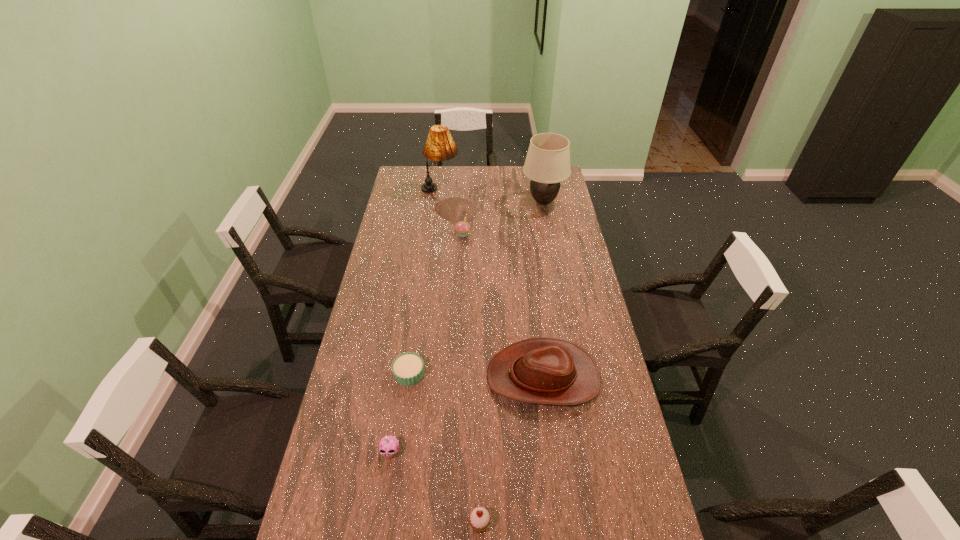
Where is `the left lampshade`? Image resolution: width=960 pixels, height=540 pixels. the left lampshade is located at coordinates (440, 146).

You are a GUI agent. You are given a task and a screenshot of the screen. Output one action in this format:
    pyautogui.click(x=<x>, y=<y>)
    Task: Click on the right lampshade
    The width and height of the screenshot is (960, 540).
    Given the screenshot: What is the action you would take?
    pyautogui.click(x=547, y=163)

The height and width of the screenshot is (540, 960). What are the coordinates of `the farthest cupcake` in the screenshot? It's located at (462, 228).

This screenshot has width=960, height=540. Identify the location of the third cupcake from left to right. (462, 228).

Identify the location of cowboy hat. The height and width of the screenshot is (540, 960). (549, 371).

In order to click on the second nearest cupcake in this screenshot , I will do `click(388, 447)`.

At what (x,y) coordinates should I click in order to perform the action: click on the nearest object. Please return your answer as a coordinate pair (x, y). Image resolution: width=960 pixels, height=540 pixels. Looking at the image, I should click on (479, 519).

Image resolution: width=960 pixels, height=540 pixels. What are the coordinates of `the nearest cupcake` in the screenshot? It's located at (479, 519).

At what (x,y) coordinates should I click in order to perform the action: click on the shortest object. Please return your answer as a coordinate pair (x, y). This screenshot has width=960, height=540. Looking at the image, I should click on click(x=407, y=368).

The width and height of the screenshot is (960, 540). In order to click on the second farthest cupcake in this screenshot , I will do `click(407, 368)`.